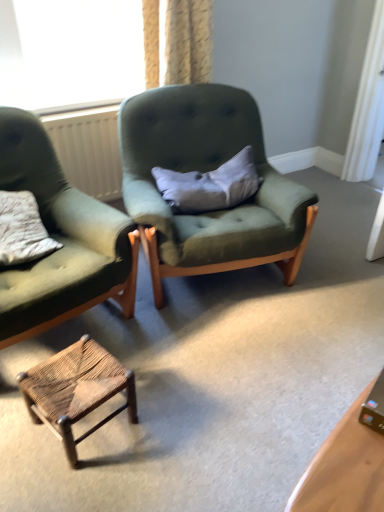
Question: Is gray fabric pillow at center smaller than rustic woven stool at lower center?

Choices:
 (A) yes
 (B) no

Answer: (B)

Question: Can we say gray fabric pillow at center lies outside rustic woven stool at lower center?

Choices:
 (A) no
 (B) yes

Answer: (B)

Question: Is gray fabric pillow at center far away from rustic woven stool at lower center?

Choices:
 (A) yes
 (B) no

Answer: (B)

Question: Can you confirm if gray fabric pillow at center is taller than rustic woven stool at lower center?

Choices:
 (A) yes
 (B) no

Answer: (B)

Question: From the image's perspective, is gray fabric pillow at center below rustic woven stool at lower center?

Choices:
 (A) yes
 (B) no

Answer: (B)

Question: Could you tell me if gray fabric pillow at center is turned towards rustic woven stool at lower center?

Choices:
 (A) yes
 (B) no

Answer: (B)

Question: Is matte green fabric chair at left, acting as the 2th chair starting from the right, at the right side of gray fabric pillow at center?

Choices:
 (A) no
 (B) yes

Answer: (A)

Question: Is matte green fabric chair at left, the 1th chair when ordered from left to right, positioned beyond the bounds of gray fabric pillow at center?

Choices:
 (A) yes
 (B) no

Answer: (A)

Question: Does matte green fabric chair at left, acting as the 2th chair starting from the right, come behind gray fabric pillow at center?

Choices:
 (A) yes
 (B) no

Answer: (B)

Question: Is gray fabric pillow at center located within matte green fabric chair at left, acting as the 2th chair starting from the right?

Choices:
 (A) yes
 (B) no

Answer: (B)

Question: From the image's perspective, is matte green fabric chair at left, acting as the 2th chair starting from the right, under gray fabric pillow at center?

Choices:
 (A) yes
 (B) no

Answer: (A)

Question: Is matte green fabric chair at left, acting as the 2th chair starting from the right, thinner than gray fabric pillow at center?

Choices:
 (A) no
 (B) yes

Answer: (A)

Question: From the image's perspective, would you say rustic woven stool at lower center is shown under matte green fabric chair at left, acting as the 2th chair starting from the right?

Choices:
 (A) no
 (B) yes

Answer: (B)